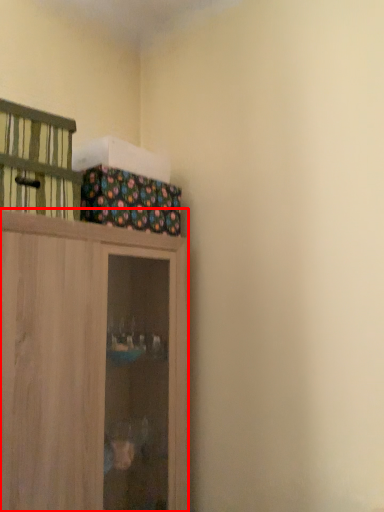
Question: Observing the image, what is the correct spatial positioning of cupboard (annotated by the red box) in reference to cabinetry?

Choices:
 (A) left
 (B) right

Answer: (B)